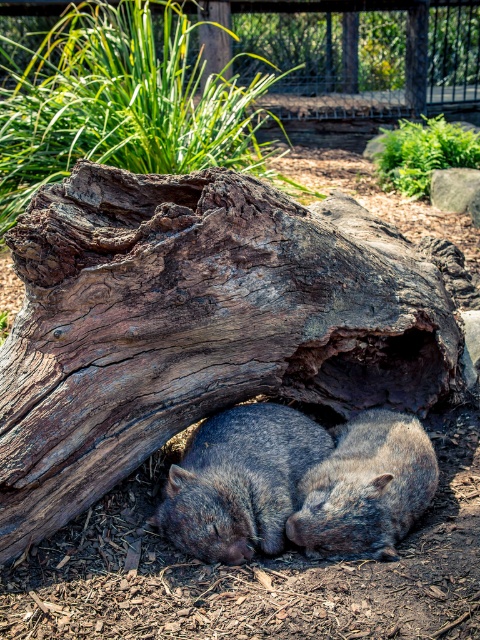
In the scene shown: You are a wildlife photographer trying to capture a closeup shot of both wombats. Your camera has a 12 inch wide lens. Can you fit both the fuzzy gray wombat at center and the gray furry wombat at center into the frame without moving the camera?

The fuzzy gray wombat at center and the gray furry wombat at center are 10.03 inches apart, so yes, the 12 inch wide lens can easily accommodate both wombats within the frame since the distance between them is less than the lens width.

You are a wildlife photographer aiming to capture a closeup shot of the gray furry wombat at center without including the gray rough bark tree trunk at center in the frame. Given their positions, do you think this is possible?

The gray rough bark tree trunk at center is wider than the gray furry wombat at center, so it might block part of the wombat. However, since they are both at the center, adjusting the camera angle slightly could allow focusing solely on the wombat while excluding the tree trunk.

You are observing two wombats in the image. Which of the two wombats, the fuzzy gray wombat at center or the gray furry wombat at center, is located to the left?

The fuzzy gray wombat at center is positioned on the left side of the gray furry wombat at center.